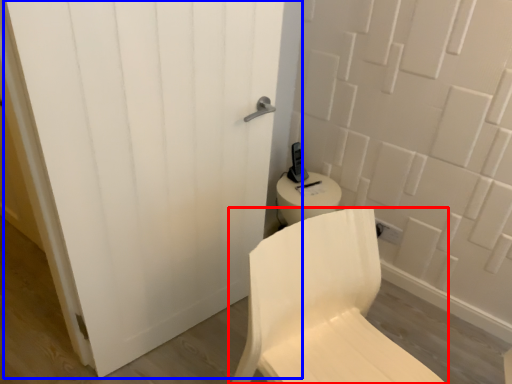
Question: Which object is further to the camera taking this photo, chair (highlighted by a red box) or door (highlighted by a blue box)?

Choices:
 (A) chair
 (B) door

Answer: (B)